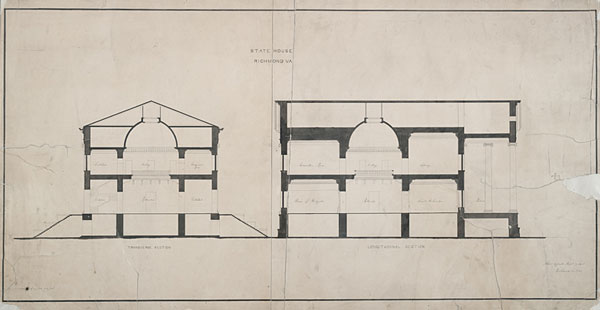
I want to click on curved ceiling, so click(x=386, y=120).